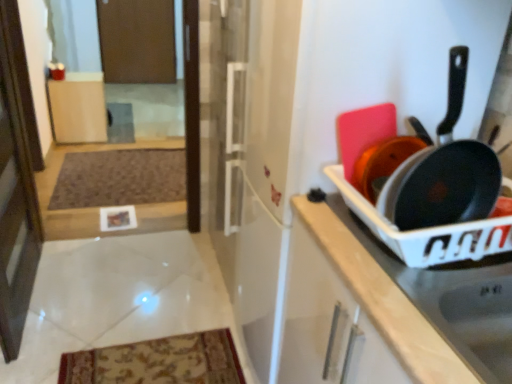
Question: Choose the correct answer: Is transparent glass screen door at left, which ranks as the first screen door in bottom-to-top order, inside brown textured mat at lower left or outside it?

Choices:
 (A) outside
 (B) inside

Answer: (A)

Question: In terms of height, does transparent glass screen door at left, the 1th screen door viewed from the front, look taller or shorter compared to brown textured mat at lower left?

Choices:
 (A) short
 (B) tall

Answer: (B)

Question: Estimate the real-world distances between objects in this image. Which object is closer to the matte black pan at right?

Choices:
 (A) transparent glass screen door at left, marked as the 2th screen door in a back-to-front arrangement
 (B) matte black frying pan at right
 (C) matte wood cabinet at center, which is the second cabinetry from right to left
 (D) white plastic tray at right, arranged as the second cabinetry when viewed from the top
 (E) brown matte screen door at upper center, marked as the 1th screen door in a back-to-front arrangement

Answer: (B)

Question: Considering the real-world distances, which object is closest to the transparent glass screen door at left, positioned as the 2th screen door in top-to-bottom order?

Choices:
 (A) brown matte screen door at upper center, which is counted as the 2th screen door, starting from the bottom
 (B) brown textured mat at lower left
 (C) matte wood cabinet at center, which is the second cabinetry from right to left
 (D) white plastic tray at right, marked as the first cabinetry in a bottom-to-top arrangement
 (E) matte black frying pan at right

Answer: (B)